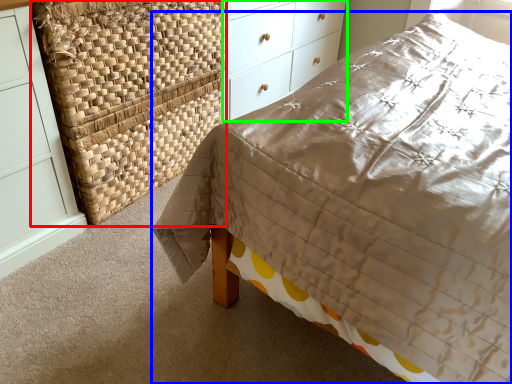
Question: Which object is positioned closest to basket (highlighted by a red box)? Select from bed (highlighted by a blue box) and chest of drawers (highlighted by a green box).

Choices:
 (A) bed
 (B) chest of drawers

Answer: (B)